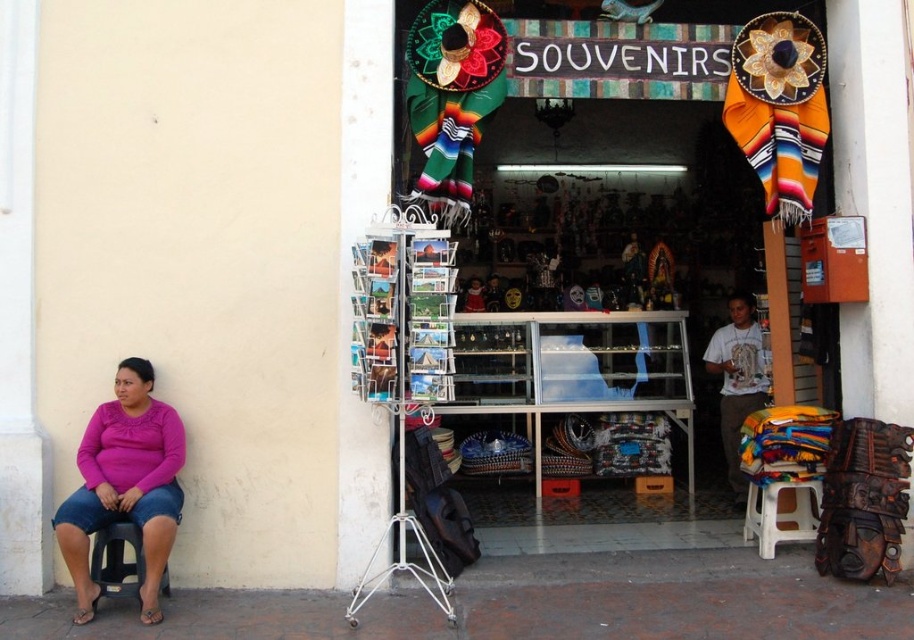
Between pink matte shirt at lower left and white plastic stool at lower right, which one is positioned higher?

Positioned higher is pink matte shirt at lower left.

Is pink matte shirt at lower left to the right of white plastic stool at lower right from the viewer's perspective?

In fact, pink matte shirt at lower left is to the left of white plastic stool at lower right.

The width and height of the screenshot is (914, 640). Describe the element at coordinates (125, 484) in the screenshot. I see `pink matte shirt at lower left` at that location.

Find the location of a particular element. The width and height of the screenshot is (914, 640). pink matte shirt at lower left is located at coordinates (125, 484).

Does point (141, 525) come in front of point (104, 545)?

Yes, it is in front of point (104, 545).

Who is positioned more to the left, pink matte shirt at lower left or black plastic stool at lower left?

Positioned to the left is black plastic stool at lower left.

Which is behind, point (150, 582) or point (107, 576)?

Positioned behind is point (107, 576).

In order to click on pink matte shirt at lower left in this screenshot , I will do `click(125, 484)`.

Is white plastic stool at lower right positioned behind black plastic stool at lower left?

Yes.

Does white plastic stool at lower right have a greater width compared to black plastic stool at lower left?

Incorrect, white plastic stool at lower right's width does not surpass black plastic stool at lower left's.

Does point (771, 490) lie behind point (102, 588)?

Yes, point (771, 490) is behind point (102, 588).

The image size is (914, 640). Identify the location of white plastic stool at lower right. (781, 513).